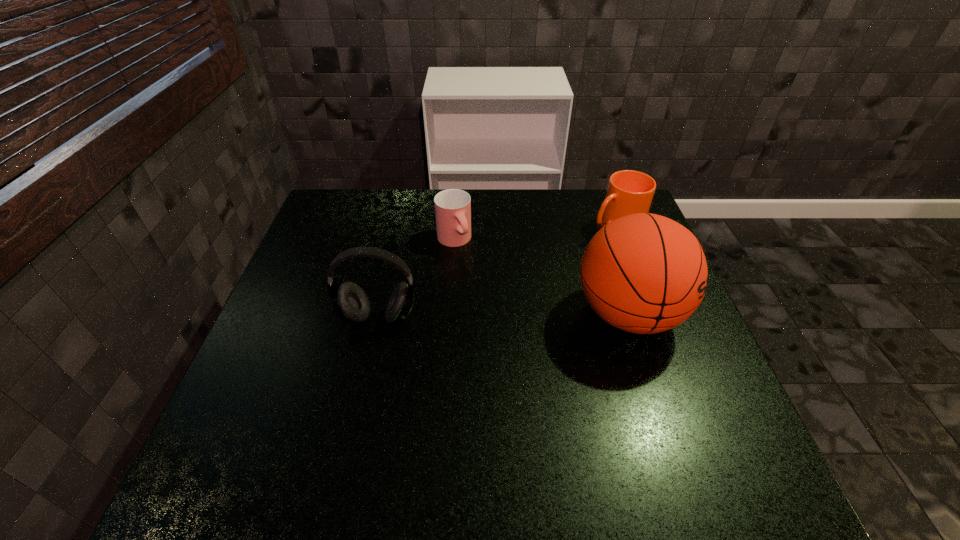
The height and width of the screenshot is (540, 960). Find the location of `vacant point at the right edge`. vacant point at the right edge is located at coordinates (690, 380).

Locate an element on the screen. free space at the far left corner of the desktop is located at coordinates 374,192.

Where is `free location at the near right corner`? free location at the near right corner is located at coordinates (727, 437).

This screenshot has width=960, height=540. I want to click on unoccupied area between the third object from right to left and the third tallest object, so click(x=535, y=234).

You are a GUI agent. You are given a task and a screenshot of the screen. Output one action in this format:
    pyautogui.click(x=<x>, y=<y>)
    Task: Click on the free space between the mug and the leftmost object
    
    Given the screenshot: What is the action you would take?
    pyautogui.click(x=497, y=272)

You are a GUI agent. You are given a task and a screenshot of the screen. Output one action in this format:
    pyautogui.click(x=<x>, y=<y>)
    Task: Click on the vacant point located between the basketball and the second object from left to right
    This screenshot has height=540, width=960.
    Given the screenshot: What is the action you would take?
    pyautogui.click(x=541, y=277)

This screenshot has width=960, height=540. I want to click on free area in between the basketball and the headset, so click(x=503, y=316).

Locate an element on the screen. Image resolution: width=960 pixels, height=540 pixels. vacant space that's between the cup and the leftmost object is located at coordinates (417, 279).

At what (x,y) coordinates should I click in order to perform the action: click on free space between the mug and the cup. Please return your answer as a coordinate pair (x, y). Looking at the image, I should click on (535, 234).

Where is `free space between the third object from right to left and the basketball`? The height and width of the screenshot is (540, 960). free space between the third object from right to left and the basketball is located at coordinates (541, 277).